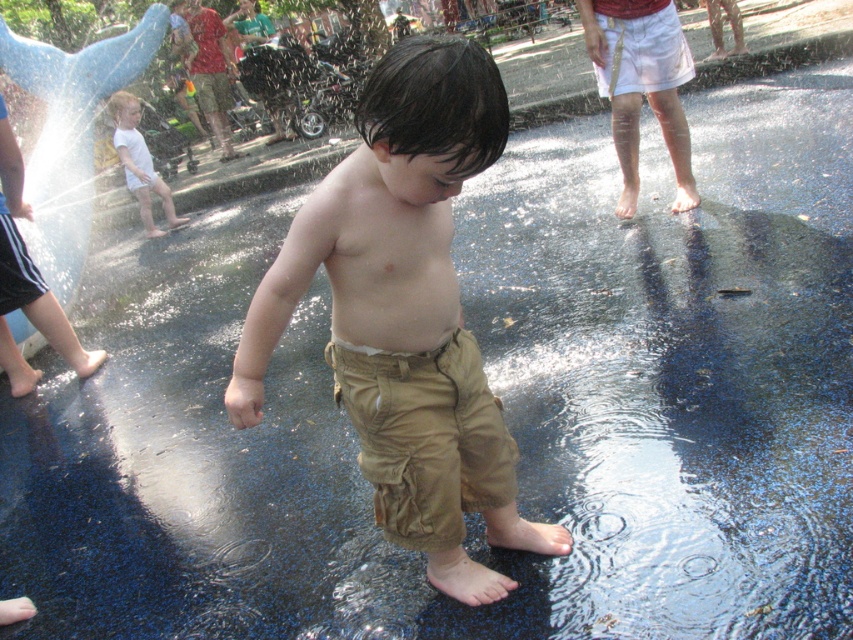
Can you confirm if khaki cotton pants at center is shorter than white cotton shirt at left?

Yes, khaki cotton pants at center is shorter than white cotton shirt at left.

Is the position of khaki cotton pants at center less distant than that of white cotton shirt at left?

That is True.

Is point (386, 316) in front of point (140, 202)?

Yes.

At what (x,y) coordinates should I click in order to perform the action: click on khaki cotton pants at center. Please return your answer as a coordinate pair (x, y). Looking at the image, I should click on (405, 312).

Is point (363, 212) positioned after point (593, 48)?

No, (363, 212) is in front of (593, 48).

Is khaki cotton pants at center bigger than khaki pants at center?

Yes, khaki cotton pants at center is bigger than khaki pants at center.

Image resolution: width=853 pixels, height=640 pixels. What do you see at coordinates (405, 312) in the screenshot? I see `khaki cotton pants at center` at bounding box center [405, 312].

This screenshot has width=853, height=640. Find the location of `khaki cotton pants at center`. khaki cotton pants at center is located at coordinates (405, 312).

Who is taller, khaki pants at center or white cotton shirt at left?

white cotton shirt at left

Between point (694, 204) and point (146, 164), which one is positioned behind?

The point (146, 164) is more distant.

The image size is (853, 640). Describe the element at coordinates (642, 90) in the screenshot. I see `khaki pants at center` at that location.

Where is `khaki pants at center`? khaki pants at center is located at coordinates (642, 90).